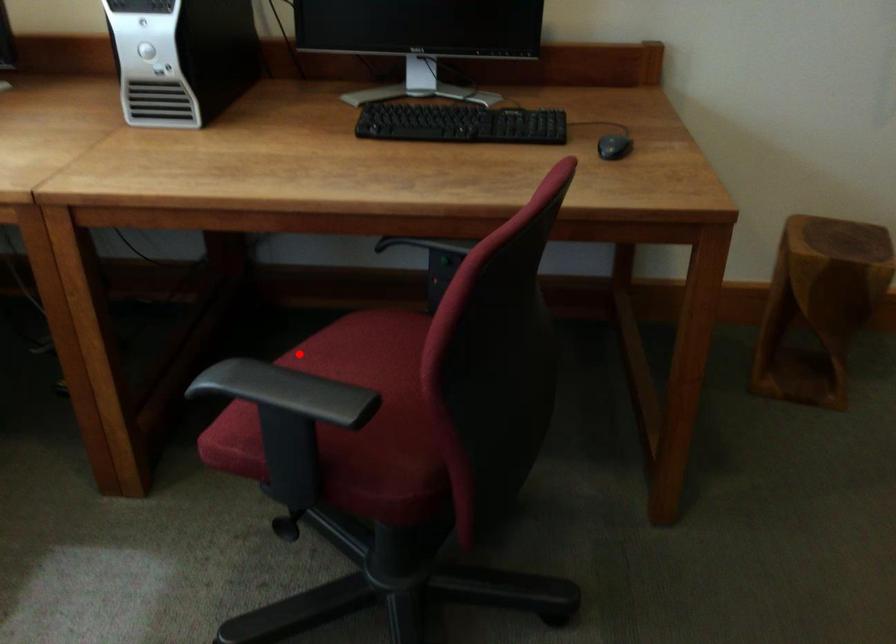
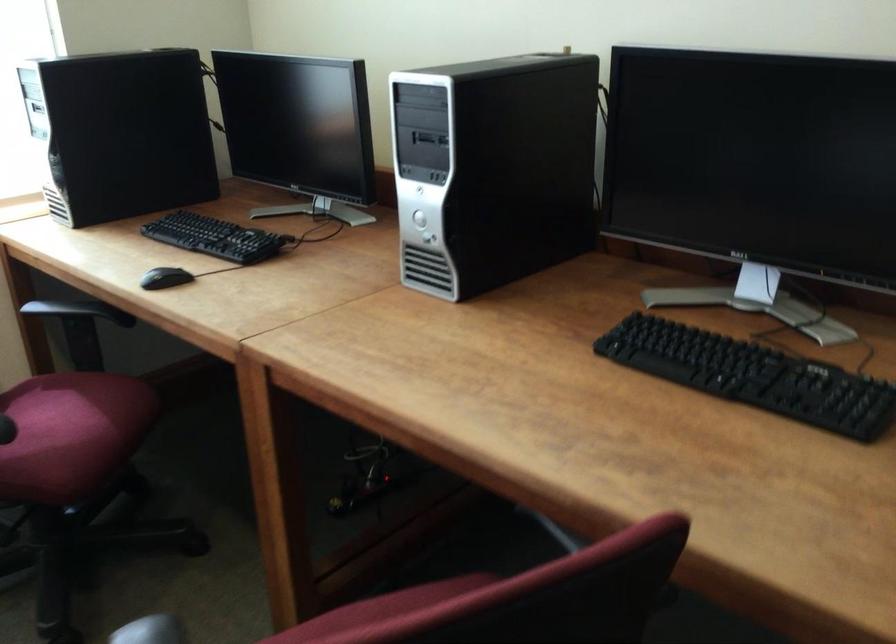
Question: I am providing you with two images of the same scene from different viewpoints. Image1 has a red point marked. In image2, the corresponding 3D location appears at what relative position? Reply with the corresponding letter.

Choices:
 (A) Closer
 (B) Farther

Answer: (A)